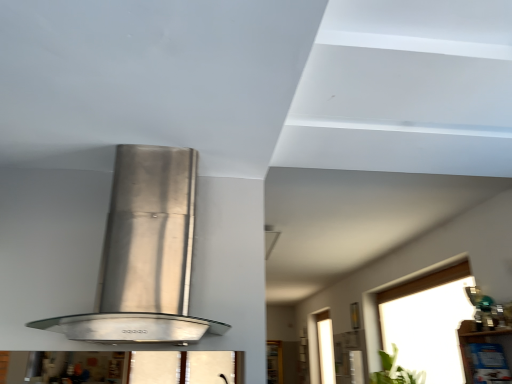
Question: Would you consider clear glass window at upper right to be distant from satin silver range hood at center?

Choices:
 (A) no
 (B) yes

Answer: (B)

Question: Can you confirm if clear glass window at upper right is smaller than satin silver range hood at center?

Choices:
 (A) yes
 (B) no

Answer: (B)

Question: Does clear glass window at upper right have a larger size compared to satin silver range hood at center?

Choices:
 (A) no
 (B) yes

Answer: (B)

Question: From a real-world perspective, is clear glass window at upper right located higher than satin silver range hood at center?

Choices:
 (A) no
 (B) yes

Answer: (A)

Question: Is the position of clear glass window at upper right more distant than that of satin silver range hood at center?

Choices:
 (A) no
 (B) yes

Answer: (B)

Question: From the image's perspective, is clear glass window at upper right on satin silver range hood at center?

Choices:
 (A) no
 (B) yes

Answer: (A)

Question: Is clear glass window at upper right thinner than green leafy plant at lower right?

Choices:
 (A) no
 (B) yes

Answer: (B)

Question: From the image's perspective, is clear glass window at upper right on top of green leafy plant at lower right?

Choices:
 (A) no
 (B) yes

Answer: (B)

Question: Does clear glass window at upper right have a greater width compared to green leafy plant at lower right?

Choices:
 (A) no
 (B) yes

Answer: (A)

Question: From the image's perspective, would you say clear glass window at upper right is shown under green leafy plant at lower right?

Choices:
 (A) no
 (B) yes

Answer: (A)

Question: Is clear glass window at upper right facing towards green leafy plant at lower right?

Choices:
 (A) yes
 (B) no

Answer: (A)

Question: From a real-world perspective, is clear glass window at upper right located beneath green leafy plant at lower right?

Choices:
 (A) no
 (B) yes

Answer: (A)

Question: Is satin silver range hood at center to the right of clear glass window at upper right from the viewer's perspective?

Choices:
 (A) no
 (B) yes

Answer: (A)